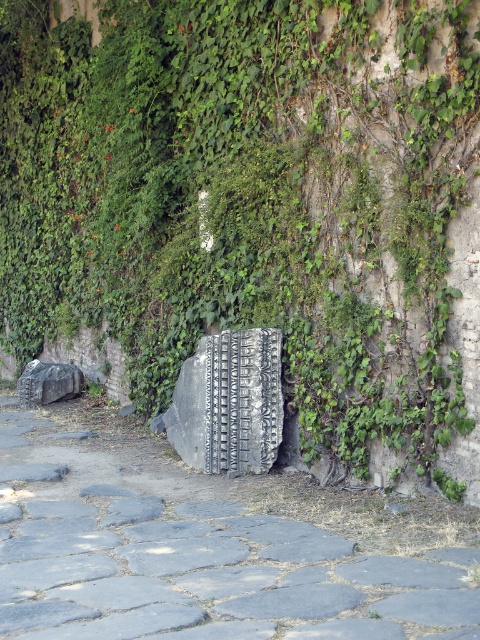
Does point (52, 602) come behind point (226, 364)?

No.

Based on the photo, is gray stone pavement at center taller than black textured stone at center?

No, gray stone pavement at center is not taller than black textured stone at center.

Between point (127, 627) and point (211, 371), which one is positioned behind?

The point (211, 371) is more distant.

Where is `gray stone pavement at center`? gray stone pavement at center is located at coordinates (213, 545).